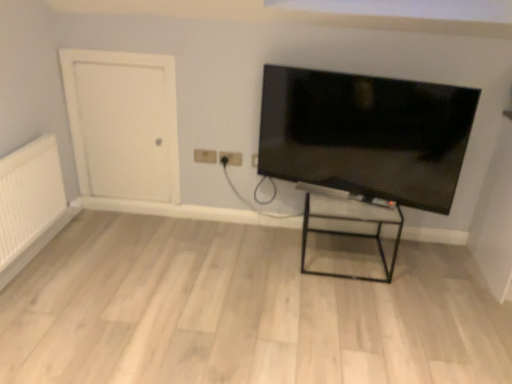
The image size is (512, 384). What are the coordinates of `vacant space underneath white matte door at left (from a real-world perspective)` in the screenshot? It's located at (133, 209).